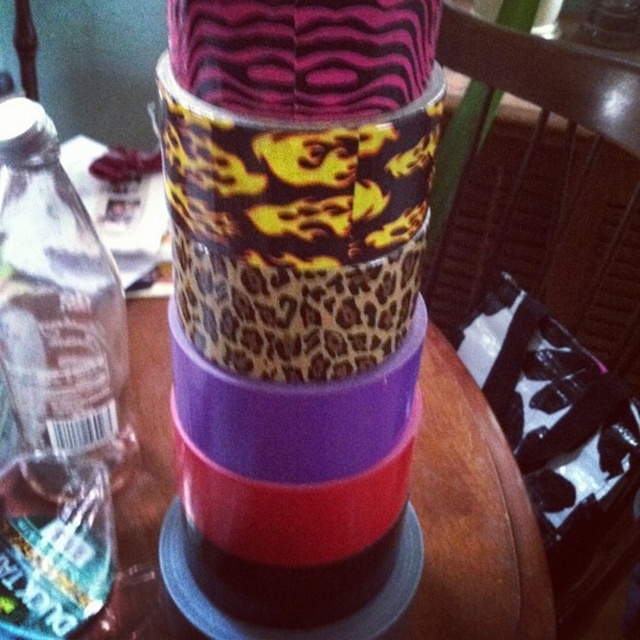
You are standing at the origin point of the coordinate system in the image. Where is the purple matte plastic table at center located?

The purple matte plastic table at center is located at coordinates point (x=472, y=518).

Based on the photo, you are standing in front of a table with a stack of three colorful cylindrical containers. The containers are arranged from largest to smallest from bottom to top. The bottom container is red, the middle is purple, and the top has an animal print. There is also a point marked at coordinates (531, 577). Can you determine if the point is closer to you than the red container?

The point at coordinates (531, 577) is 20.26 inches away from the viewer, but the distance of the red container is not provided. Therefore, it is impossible to determine if the point is closer to you than the red container without additional information.

You are organizing a shelf and need to place both the leopard print tape at center and the clear plastic bottle at left. Since you want to ensure stability, which item should you place at the bottom to prevent the stack from tipping over?

The leopard print tape at center has a greater height compared to the clear plastic bottle at left. To prevent tipping, place the taller leopard print tape at center at the bottom since its height provides a wider base for stability.